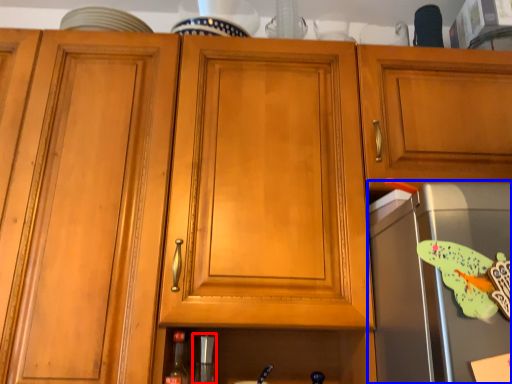
Question: Which object is further to the camera taking this photo, appliance (highlighted by a red box) or appliance (highlighted by a blue box)?

Choices:
 (A) appliance
 (B) appliance

Answer: (A)